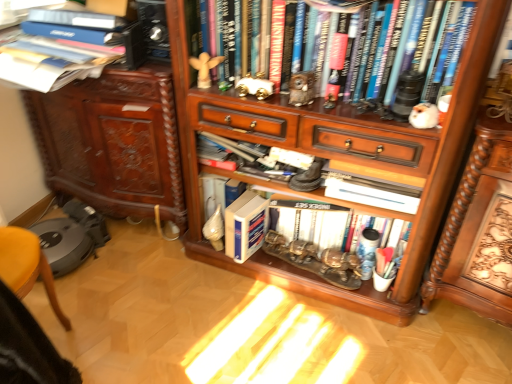
Question: Is point (386, 38) positioned closer to the camera than point (348, 233)?

Choices:
 (A) farther
 (B) closer

Answer: (B)

Question: Considering the positions of hardcover books at upper center, the second book positioned from the top, and white matte book at center, which is the third book in top-to-bottom order, in the image, is hardcover books at upper center, the second book positioned from the top, taller or shorter than white matte book at center, which is the third book in top-to-bottom order,?

Choices:
 (A) tall
 (B) short

Answer: (A)

Question: Considering the real-world distances, which object is closest to the wooden bookcase at center?

Choices:
 (A) hardcover book at upper left, placed as the fourth book when sorted from bottom to top
 (B) white matte book at center, which is the third book in top-to-bottom order
 (C) blue hardcover book at center, the fourth book from the top
 (D) wooden cabinet at left
 (E) hardcover books at upper center, the third book positioned from the bottom

Answer: (B)

Question: Based on their relative distances, which object is farther from the blue hardcover book at center, the fourth book from the top?

Choices:
 (A) hardcover book at upper left, positioned as the first book in top-to-bottom order
 (B) white matte book at center, which is the third book in top-to-bottom order
 (C) hardcover books at upper center, the second book positioned from the top
 (D) wooden cabinet at left
 (E) wooden bookcase at center

Answer: (A)